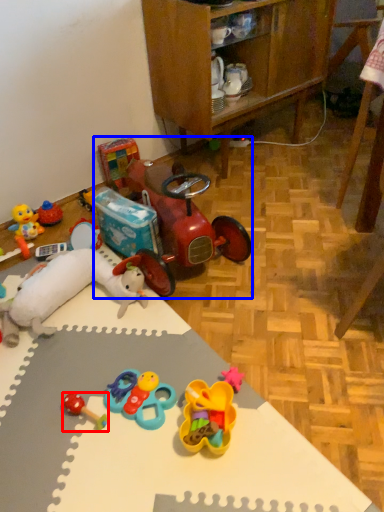
Question: Which object is closer to the camera taking this photo, toy (highlighted by a red box) or toy car (highlighted by a blue box)?

Choices:
 (A) toy
 (B) toy car

Answer: (A)